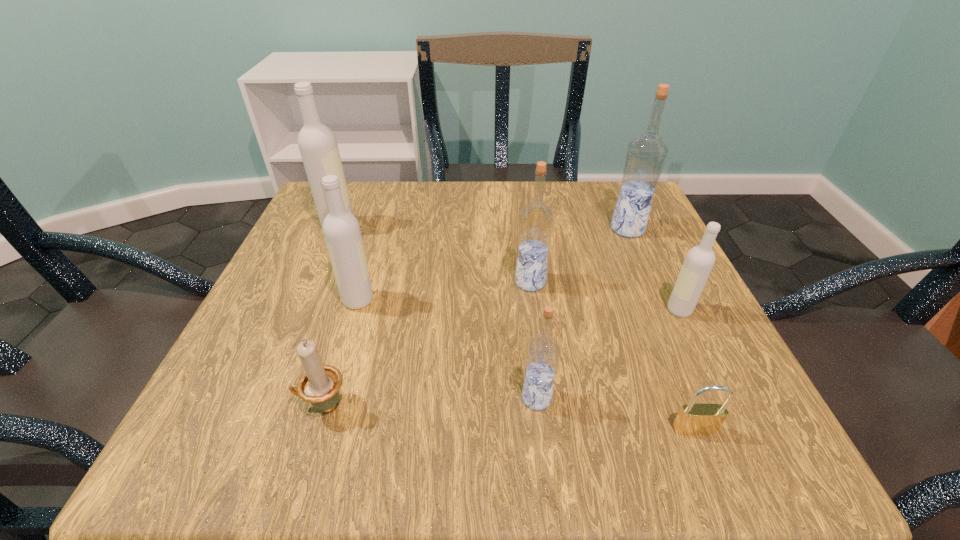
The width and height of the screenshot is (960, 540). What are the coordinates of `vacant space at the near edge of the desktop` in the screenshot? It's located at (640, 467).

In the image, there is a desktop. Find the location of `free space at the left edge`. free space at the left edge is located at coordinates (235, 345).

Locate an element on the screen. Image resolution: width=960 pixels, height=540 pixels. free region at the right edge of the desktop is located at coordinates (666, 319).

In the image, there is a desktop. At what (x,y) coordinates should I click in order to perform the action: click on vacant space at the far left corner. Please return your answer as a coordinate pair (x, y). Looking at the image, I should click on (361, 186).

The image size is (960, 540). In the image, there is a desktop. What are the coordinates of `free space at the near left corner` in the screenshot? It's located at (307, 426).

Image resolution: width=960 pixels, height=540 pixels. What are the coordinates of `free area in between the second white vodka from left to right and the second farthest blue vodka` in the screenshot? It's located at (444, 291).

This screenshot has height=540, width=960. Identify the location of free space that is in between the smallest white vodka and the second white vodka from right to left. (518, 305).

Locate an element on the screen. Image resolution: width=960 pixels, height=540 pixels. vacant space that's between the nearest vodka and the leftmost object is located at coordinates (438, 312).

Find the location of a particular element. This screenshot has height=540, width=960. unoccupied area between the second biggest blue vodka and the rightmost blue vodka is located at coordinates (579, 255).

The height and width of the screenshot is (540, 960). In order to click on vacant point located between the biggest white vodka and the rightmost blue vodka in this screenshot , I will do `click(483, 227)`.